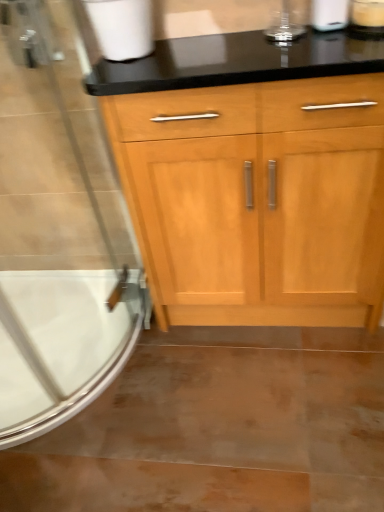
Question: Is white glossy bathtub at lower left positioned beyond the bounds of satin nickel faucet at upper left?

Choices:
 (A) yes
 (B) no

Answer: (A)

Question: Is white glossy bathtub at lower left surrounding satin nickel faucet at upper left?

Choices:
 (A) no
 (B) yes

Answer: (A)

Question: Is white glossy bathtub at lower left far from satin nickel faucet at upper left?

Choices:
 (A) no
 (B) yes

Answer: (A)

Question: Can you confirm if white glossy bathtub at lower left is taller than satin nickel faucet at upper left?

Choices:
 (A) yes
 (B) no

Answer: (B)

Question: Can you confirm if white glossy bathtub at lower left is thinner than satin nickel faucet at upper left?

Choices:
 (A) yes
 (B) no

Answer: (B)

Question: Does white glossy bathtub at lower left turn towards satin nickel faucet at upper left?

Choices:
 (A) yes
 (B) no

Answer: (B)

Question: Is clear glass screen door at left not close to white matte toilet paper at upper left, the second toilet paper positioned from the right?

Choices:
 (A) no
 (B) yes

Answer: (A)

Question: Is clear glass screen door at left turned away from white matte toilet paper at upper left, the second toilet paper positioned from the right?

Choices:
 (A) yes
 (B) no

Answer: (B)

Question: From a real-world perspective, does clear glass screen door at left stand above white matte toilet paper at upper left, the second toilet paper positioned from the right?

Choices:
 (A) no
 (B) yes

Answer: (A)

Question: Considering the relative sizes of clear glass screen door at left and white matte toilet paper at upper left, the first toilet paper from the left, in the image provided, is clear glass screen door at left smaller than white matte toilet paper at upper left, the first toilet paper from the left,?

Choices:
 (A) yes
 (B) no

Answer: (B)

Question: Is clear glass screen door at left further to the viewer compared to white matte toilet paper at upper left, the second toilet paper positioned from the right?

Choices:
 (A) yes
 (B) no

Answer: (B)

Question: Is clear glass screen door at left taller than white matte toilet paper at upper left, the first toilet paper from the left?

Choices:
 (A) no
 (B) yes

Answer: (B)

Question: Does white matte toilet paper at upper left, the second toilet paper positioned from the right, appear on the right side of white matte toilet paper at upper right, placed as the 2th toilet paper when sorted from left to right?

Choices:
 (A) yes
 (B) no

Answer: (B)